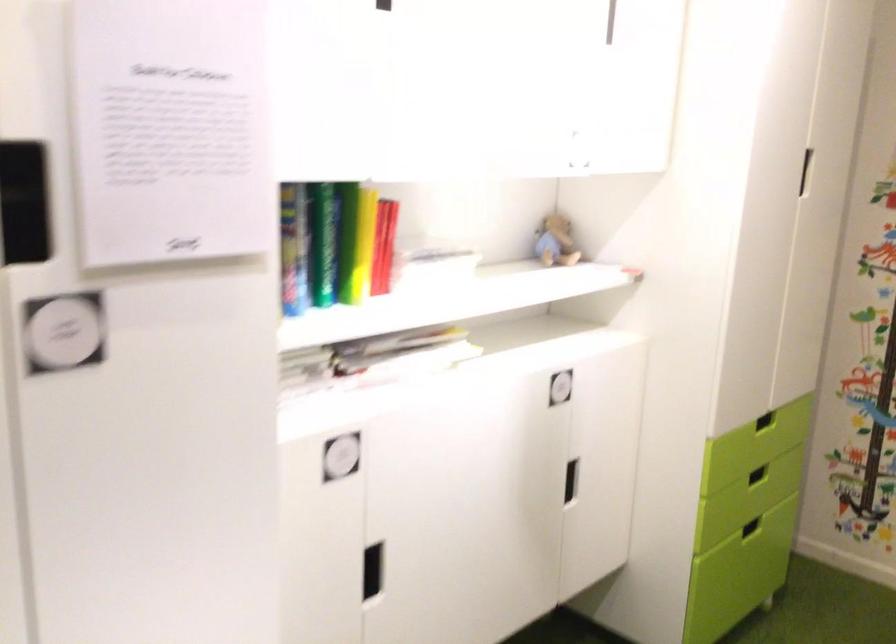
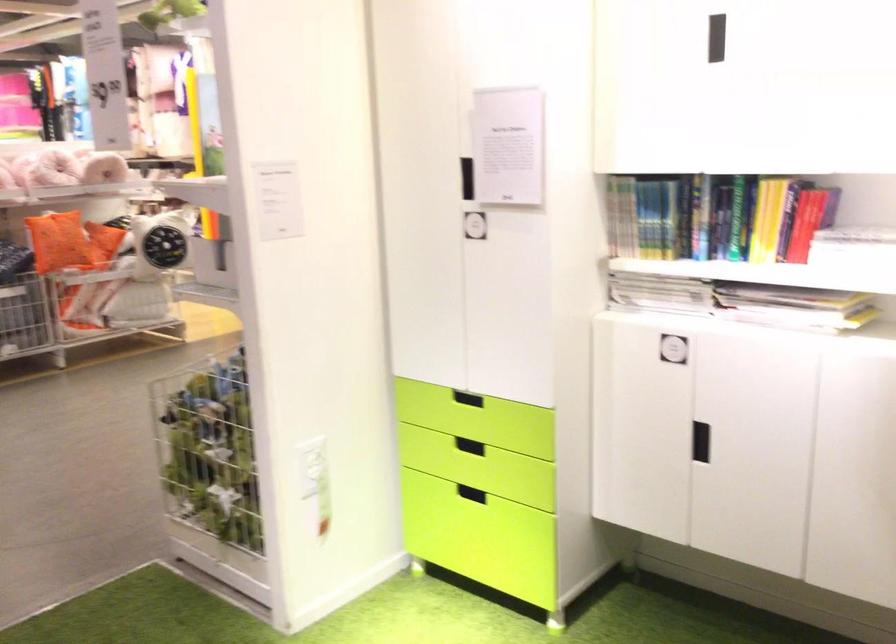
The point at (x=306, y=252) is marked in the first image. Where is the corresponding point in the second image?

(717, 216)